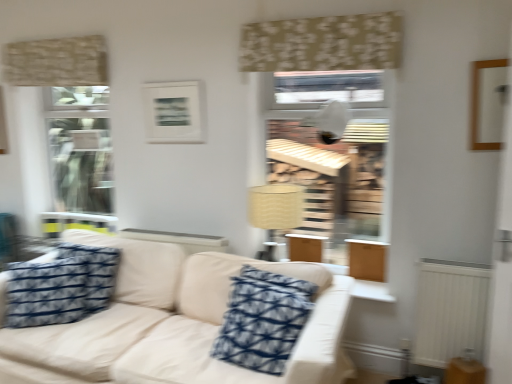
Question: From a real-world perspective, is beige textured curtain at upper left, positioned as the 2th curtain in front-to-back order, on top of beige fabric lampshade at center?

Choices:
 (A) yes
 (B) no

Answer: (A)

Question: Is beige textured curtain at upper left, arranged as the second curtain when viewed from the right, oriented towards beige fabric lampshade at center?

Choices:
 (A) yes
 (B) no

Answer: (B)

Question: From the image's perspective, is beige textured curtain at upper left, arranged as the second curtain when viewed from the right, on top of beige fabric lampshade at center?

Choices:
 (A) yes
 (B) no

Answer: (A)

Question: Is beige fabric lampshade at center completely or partially inside beige textured curtain at upper left, acting as the first curtain starting from the left?

Choices:
 (A) yes
 (B) no

Answer: (B)

Question: Is beige textured curtain at upper left, positioned as the 2th curtain in front-to-back order, positioned before beige fabric lampshade at center?

Choices:
 (A) yes
 (B) no

Answer: (B)

Question: Based on their positions, is beige textured curtain at upper left, acting as the first curtain starting from the left, located to the left or right of beige fabric lampshade at center?

Choices:
 (A) right
 (B) left

Answer: (B)

Question: Is beige textured curtain at upper left, positioned as the 2th curtain in front-to-back order, inside the boundaries of beige fabric lampshade at center, or outside?

Choices:
 (A) inside
 (B) outside

Answer: (B)

Question: Is beige textured curtain at upper left, acting as the first curtain starting from the back, taller or shorter than beige fabric lampshade at center?

Choices:
 (A) short
 (B) tall

Answer: (A)

Question: Is beige textured curtain at upper left, acting as the first curtain starting from the left, wider or thinner than beige fabric lampshade at center?

Choices:
 (A) thin
 (B) wide

Answer: (A)

Question: Is wooden picture frame at upper right, which is counted as the second picture frame, starting from the back, to the left or to the right of beige fabric couch at center in the image?

Choices:
 (A) right
 (B) left

Answer: (A)

Question: Considering the positions of wooden picture frame at upper right, placed as the first picture frame when sorted from front to back, and beige fabric couch at center in the image, is wooden picture frame at upper right, placed as the first picture frame when sorted from front to back, taller or shorter than beige fabric couch at center?

Choices:
 (A) tall
 (B) short

Answer: (B)

Question: From the image's perspective, is wooden picture frame at upper right, placed as the first picture frame when sorted from front to back, positioned above or below beige fabric couch at center?

Choices:
 (A) below
 (B) above

Answer: (B)

Question: Considering the positions of wooden picture frame at upper right, positioned as the second picture frame in left-to-right order, and beige fabric couch at center in the image, is wooden picture frame at upper right, positioned as the second picture frame in left-to-right order, wider or thinner than beige fabric couch at center?

Choices:
 (A) wide
 (B) thin

Answer: (B)

Question: Is blue printed fabric pillow at center, which appears as the second pillow when viewed from the left, taller or shorter than beige floral fabric at upper center, which is the first curtain in right-to-left order?

Choices:
 (A) tall
 (B) short

Answer: (A)

Question: Based on their sizes in the image, would you say blue printed fabric pillow at center, which appears as the second pillow when viewed from the left, is bigger or smaller than beige floral fabric at upper center, which is the 2th curtain in back-to-front order?

Choices:
 (A) small
 (B) big

Answer: (B)